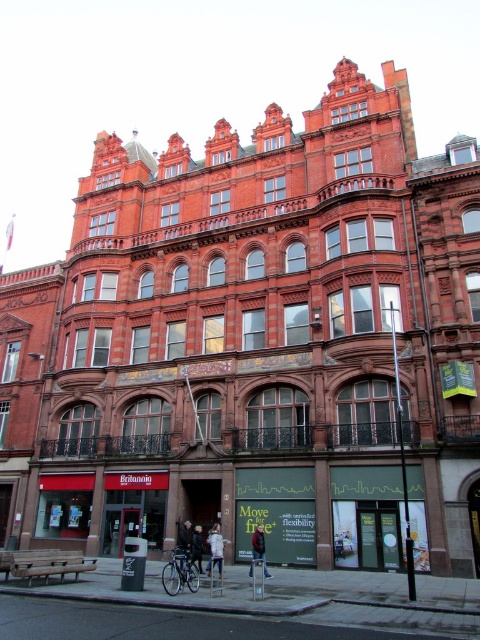
Who is higher up, shiny metallic bicycle at center or dark gray jacket at lower center?

dark gray jacket at lower center is above.

Does shiny metallic bicycle at center have a greater height compared to dark gray jacket at lower center?

In fact, shiny metallic bicycle at center may be shorter than dark gray jacket at lower center.

Between point (170, 568) and point (251, 566), which one is positioned behind?

Positioned behind is point (251, 566).

Where is `shiny metallic bicycle at center`? The width and height of the screenshot is (480, 640). shiny metallic bicycle at center is located at coordinates (179, 573).

Measure the distance between dark brown leather jacket at center and camera.

dark brown leather jacket at center is 38.96 meters away from camera.

Which is behind, point (179, 529) or point (260, 554)?

The point (179, 529) is more distant.

Locate an element on the screen. This screenshot has height=640, width=480. dark brown leather jacket at center is located at coordinates (184, 541).

Can you confirm if white cotton shirt at center is taller than dark gray jacket at lower center?

Yes, white cotton shirt at center is taller than dark gray jacket at lower center.

Who is lower down, white cotton shirt at center or dark gray jacket at lower center?

Positioned lower is white cotton shirt at center.

Locate an element on the screen. The image size is (480, 640). white cotton shirt at center is located at coordinates (216, 548).